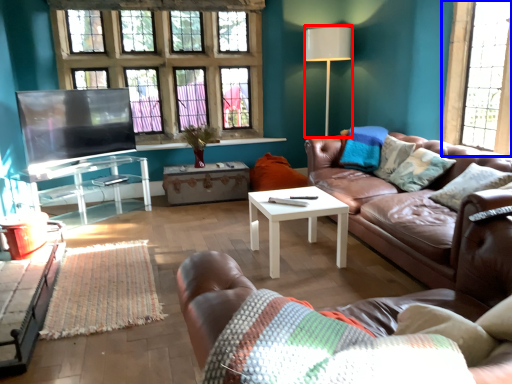
Question: Which object appears closest to the camera in this image, lamp (highlighted by a red box) or window (highlighted by a blue box)?

Choices:
 (A) lamp
 (B) window

Answer: (B)